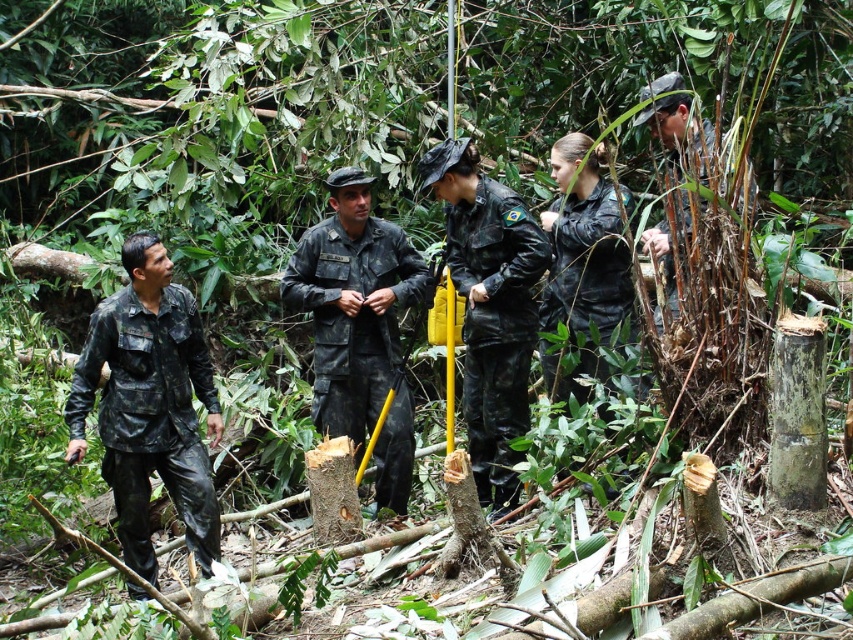
Does black matte uniform at center have a lesser height compared to black matte jacket at center?

No.

Between point (482, 464) and point (596, 285), which one is positioned behind?

Point (482, 464)

Locate an element on the screen. This screenshot has width=853, height=640. black matte uniform at center is located at coordinates [490, 308].

Who is lower down, camouflage fabric uniform at left or camouflage fabric uniform at center?

Positioned lower is camouflage fabric uniform at left.

Can you confirm if camouflage fabric uniform at left is bigger than camouflage fabric uniform at center?

Indeed, camouflage fabric uniform at left has a larger size compared to camouflage fabric uniform at center.

Between point (97, 314) and point (329, 250), which one is positioned in front?

Point (97, 314) is in front.

I want to click on camouflage fabric uniform at left, so click(149, 404).

Does camouflage fabric uniform at center have a lesser height compared to black matte jacket at center?

In fact, camouflage fabric uniform at center may be taller than black matte jacket at center.

Does camouflage fabric uniform at center appear over black matte jacket at center?

Incorrect, camouflage fabric uniform at center is not positioned above black matte jacket at center.

Image resolution: width=853 pixels, height=640 pixels. I want to click on camouflage fabric uniform at center, so click(x=352, y=305).